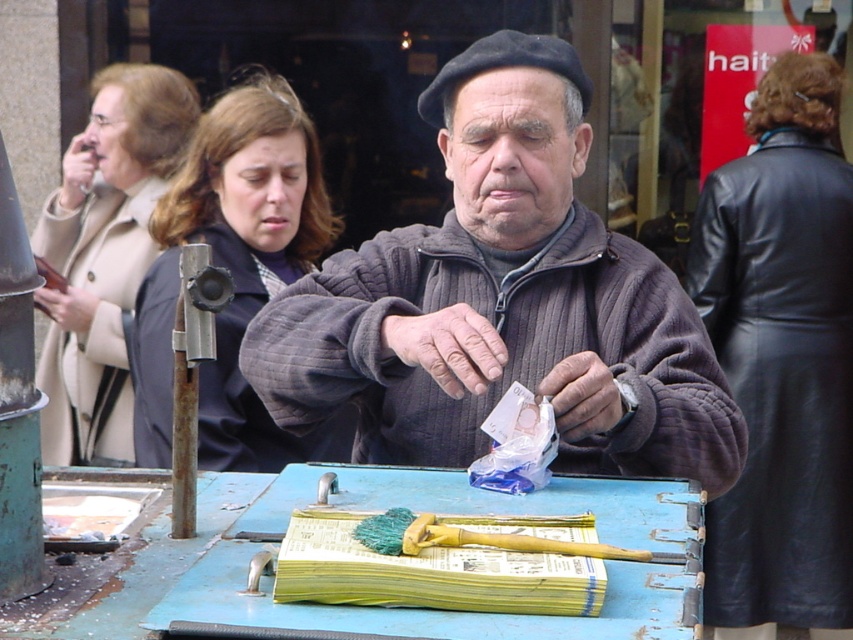
Does blue painted wood table at center appear under dark brown hair at center?

Correct, blue painted wood table at center is located below dark brown hair at center.

Is blue painted wood table at center smaller than dark brown hair at center?

Indeed, blue painted wood table at center has a smaller size compared to dark brown hair at center.

The image size is (853, 640). In order to click on blue painted wood table at center in this screenshot , I will do `click(357, 605)`.

At what (x,y) coordinates should I click in order to perform the action: click on blue painted wood table at center. Please return your answer as a coordinate pair (x, y). The image size is (853, 640). Looking at the image, I should click on (357, 605).

Does black leather coat at upper right appear on the right side of blue painted wood table at center?

Correct, you'll find black leather coat at upper right to the right of blue painted wood table at center.

Does point (834, 579) come farther from viewer compared to point (1, 612)?

That is True.

The image size is (853, 640). Describe the element at coordinates (782, 358) in the screenshot. I see `black leather coat at upper right` at that location.

Where is `black leather coat at upper right`? The image size is (853, 640). black leather coat at upper right is located at coordinates (782, 358).

Which of these two, dark gray sweater at center or blue painted wood table at center, stands shorter?

blue painted wood table at center

Who is taller, dark gray sweater at center or blue painted wood table at center?

dark gray sweater at center is taller.

Image resolution: width=853 pixels, height=640 pixels. In order to click on dark gray sweater at center in this screenshot , I will do `click(503, 301)`.

Find the location of a particular element. dark gray sweater at center is located at coordinates (503, 301).